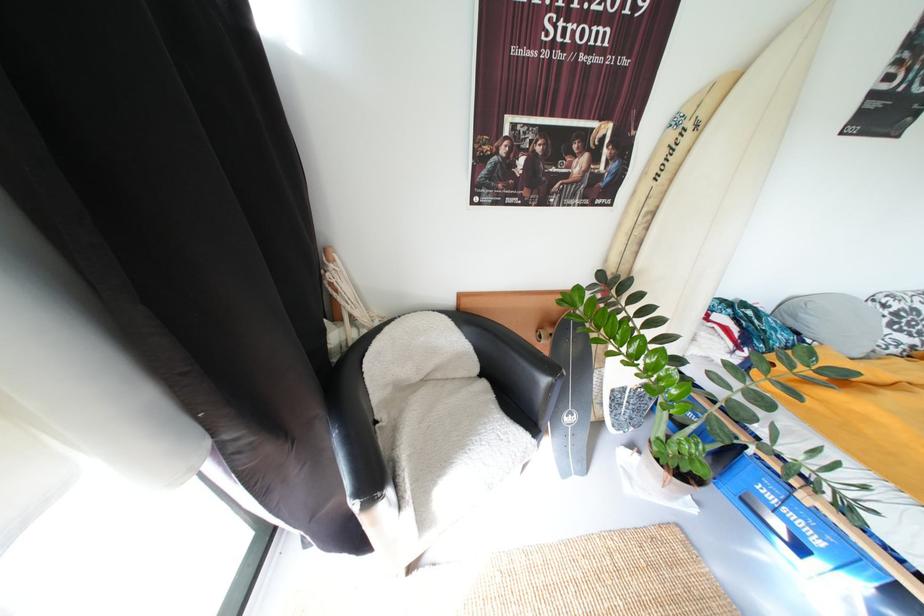
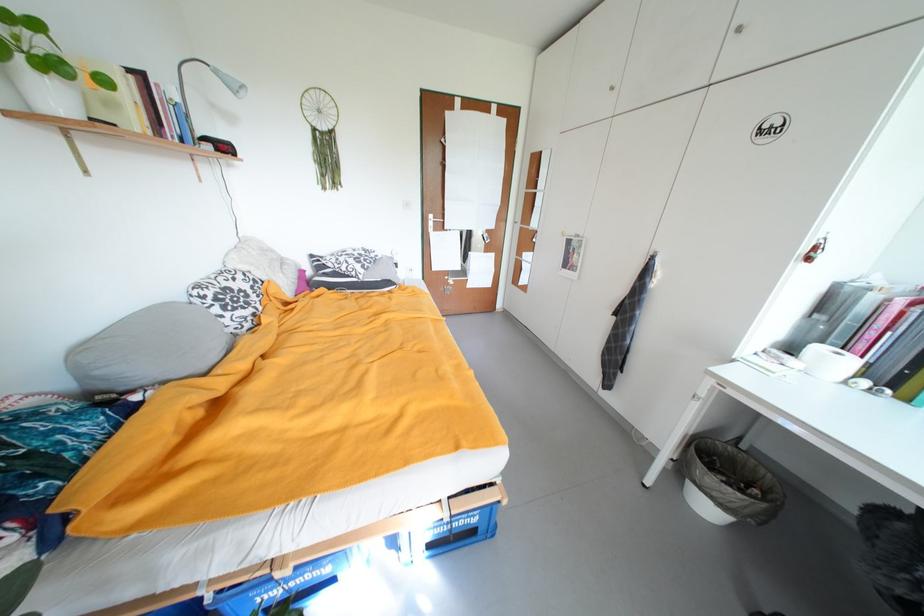
Find the pixel in the second image that matches pixel 894 309 in the first image.

(211, 299)